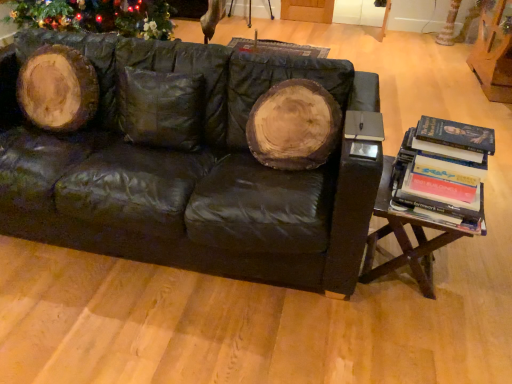
Question: Does matte black book at right lie in front of black leather couch at center?

Choices:
 (A) no
 (B) yes

Answer: (A)

Question: Is black leather couch at center a part of matte black book at right?

Choices:
 (A) yes
 (B) no

Answer: (B)

Question: Can you confirm if matte black book at right is positioned to the right of black leather couch at center?

Choices:
 (A) no
 (B) yes

Answer: (B)

Question: Is matte black book at right looking in the opposite direction of black leather couch at center?

Choices:
 (A) no
 (B) yes

Answer: (B)

Question: Would you say matte black book at right is outside black leather couch at center?

Choices:
 (A) yes
 (B) no

Answer: (B)

Question: Considering the relative sizes of matte black book at right and black leather couch at center in the image provided, is matte black book at right taller than black leather couch at center?

Choices:
 (A) no
 (B) yes

Answer: (A)

Question: Is black leather couch at center facing away from white textured tree trunk at upper right?

Choices:
 (A) no
 (B) yes

Answer: (B)

Question: Is black leather couch at center wider than white textured tree trunk at upper right?

Choices:
 (A) yes
 (B) no

Answer: (A)

Question: Are black leather couch at center and white textured tree trunk at upper right making contact?

Choices:
 (A) no
 (B) yes

Answer: (A)

Question: Does black leather couch at center turn towards white textured tree trunk at upper right?

Choices:
 (A) no
 (B) yes

Answer: (A)

Question: From a real-world perspective, is black leather couch at center physically above white textured tree trunk at upper right?

Choices:
 (A) no
 (B) yes

Answer: (B)

Question: Does black leather couch at center appear on the right side of white textured tree trunk at upper right?

Choices:
 (A) yes
 (B) no

Answer: (B)

Question: Is black leather couch at center located within hardcover books at right?

Choices:
 (A) yes
 (B) no

Answer: (B)